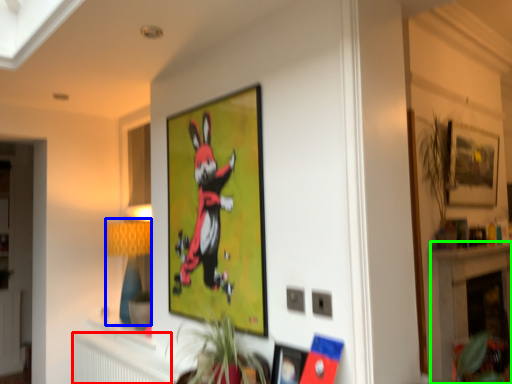
Question: Which object is the farthest from radiator (highlighted by a red box)? Choose among these: lamp (highlighted by a blue box) or fireplace (highlighted by a green box).

Choices:
 (A) lamp
 (B) fireplace

Answer: (B)